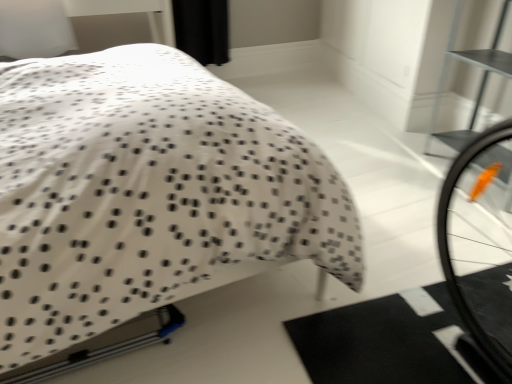
The image size is (512, 384). I want to click on metallic silver bookshelf at upper right, so click(480, 81).

In order to face metallic silver bookshelf at upper right, should I rotate leftwards or rightwards?

Rotate your view right by about 30.339°.

The width and height of the screenshot is (512, 384). What do you see at coordinates (480, 81) in the screenshot?
I see `metallic silver bookshelf at upper right` at bounding box center [480, 81].

Measure the distance between metallic silver bookshelf at upper right and camera.

They are 5.94 feet apart.

Where is `white dotted fabric bed at center`? This screenshot has width=512, height=384. white dotted fabric bed at center is located at coordinates (147, 195).

What do you see at coordinates (147, 195) in the screenshot? This screenshot has width=512, height=384. I see `white dotted fabric bed at center` at bounding box center [147, 195].

You are a GUI agent. You are given a task and a screenshot of the screen. Output one action in this format:
    pyautogui.click(x=<x>, y=<y>)
    Task: Click on the metallic silver bookshelf at upper right
    This screenshot has width=512, height=384.
    Given the screenshot: What is the action you would take?
    pyautogui.click(x=480, y=81)

Considering the relative positions of metallic silver bookshelf at upper right and white dotted fabric bed at center in the image provided, is metallic silver bookshelf at upper right to the left of white dotted fabric bed at center from the viewer's perspective?

No.

Is metallic silver bookshelf at upper right behind white dotted fabric bed at center?

Yes, it is.

Is point (450, 53) closer to camera compared to point (9, 115)?

No, it is behind (9, 115).

From the image's perspective, between metallic silver bookshelf at upper right and white dotted fabric bed at center, who is located below?

white dotted fabric bed at center.

From a real-world perspective, who is located higher, metallic silver bookshelf at upper right or white dotted fabric bed at center?

white dotted fabric bed at center is physically above.

Which object is thinner, metallic silver bookshelf at upper right or white dotted fabric bed at center?

metallic silver bookshelf at upper right.

Looking at this image, which of these two, metallic silver bookshelf at upper right or white dotted fabric bed at center, stands shorter?

With less height is metallic silver bookshelf at upper right.

Which of these two, metallic silver bookshelf at upper right or white dotted fabric bed at center, is bigger?

With larger size is white dotted fabric bed at center.

Does metallic silver bookshelf at upper right contain white dotted fabric bed at center?

That's incorrect, white dotted fabric bed at center is not inside metallic silver bookshelf at upper right.

Is metallic silver bookshelf at upper right with white dotted fabric bed at center?

No, metallic silver bookshelf at upper right is not next to white dotted fabric bed at center.

Does metallic silver bookshelf at upper right turn towards white dotted fabric bed at center?

Yes, metallic silver bookshelf at upper right is aimed at white dotted fabric bed at center.

What's the angular difference between metallic silver bookshelf at upper right and white dotted fabric bed at center's facing directions?

metallic silver bookshelf at upper right and white dotted fabric bed at center are facing 168 degrees away from each other.

How much distance is there between metallic silver bookshelf at upper right and white dotted fabric bed at center?

They are 5.10 feet apart.

Identify the location of bookshelf on the right side of white dotted fabric bed at center. This screenshot has height=384, width=512. (480, 81).

Can you confirm if white dotted fabric bed at center is positioned to the left of metallic silver bookshelf at upper right?

Correct, you'll find white dotted fabric bed at center to the left of metallic silver bookshelf at upper right.

Is white dotted fabric bed at center positioned behind metallic silver bookshelf at upper right?

No.

From the picture: Which is more distant, (360, 236) or (471, 121)?

Positioned behind is point (471, 121).

From the image's perspective, would you say white dotted fabric bed at center is shown under metallic silver bookshelf at upper right?

Correct, white dotted fabric bed at center appears lower than metallic silver bookshelf at upper right in the image.

From a real-world perspective, relative to metallic silver bookshelf at upper right, is white dotted fabric bed at center vertically above or below?

white dotted fabric bed at center is above metallic silver bookshelf at upper right.

Is white dotted fabric bed at center wider or thinner than metallic silver bookshelf at upper right?

In the image, white dotted fabric bed at center appears to be wider than metallic silver bookshelf at upper right.

Between white dotted fabric bed at center and metallic silver bookshelf at upper right, which one has less height?

metallic silver bookshelf at upper right is shorter.

Which of these two, white dotted fabric bed at center or metallic silver bookshelf at upper right, is bigger?

Bigger between the two is white dotted fabric bed at center.

Is white dotted fabric bed at center inside or outside of metallic silver bookshelf at upper right?

white dotted fabric bed at center is located beyond the bounds of metallic silver bookshelf at upper right.

Is white dotted fabric bed at center not near metallic silver bookshelf at upper right?

Yes, white dotted fabric bed at center and metallic silver bookshelf at upper right are quite far apart.

Is white dotted fabric bed at center aimed at metallic silver bookshelf at upper right?

Yes, white dotted fabric bed at center is oriented towards metallic silver bookshelf at upper right.

Can you tell me how much white dotted fabric bed at center and metallic silver bookshelf at upper right differ in facing direction?

The facing directions of white dotted fabric bed at center and metallic silver bookshelf at upper right are 168 degrees apart.

At what (x,y) coordinates should I click in order to perform the action: click on bed above the metallic silver bookshelf at upper right (from a real-world perspective). Please return your answer as a coordinate pair (x, y). The width and height of the screenshot is (512, 384). Looking at the image, I should click on (147, 195).

I want to click on bed that appears in front of the metallic silver bookshelf at upper right, so click(x=147, y=195).

This screenshot has height=384, width=512. In the image, there is a white dotted fabric bed at center. Find the location of `bookshelf above it (from the image's perspective)`. bookshelf above it (from the image's perspective) is located at coordinates (480, 81).